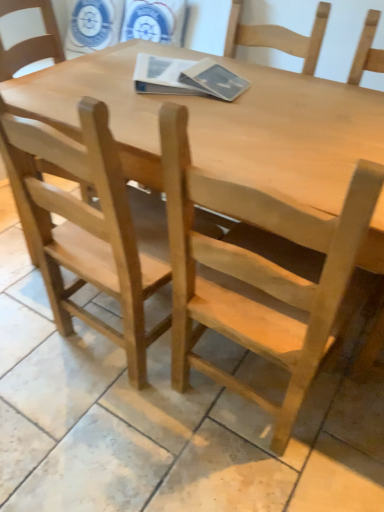
Find the location of a particular element. This screenshot has height=512, width=384. vacant space in front of natural wood chair at center, placed as the first chair when sorted from right to left is located at coordinates (240, 475).